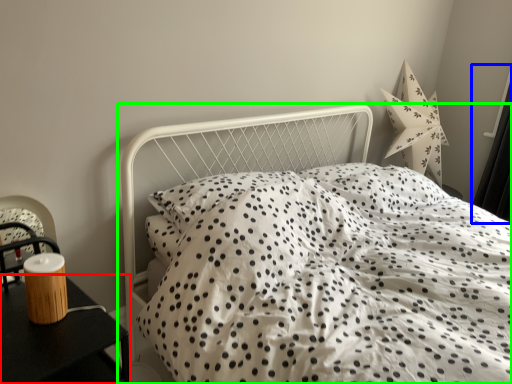
Question: Estimate the real-world distances between objects in this image. Which object is closer to nightstand (highlighted by a red box), curtain (highlighted by a blue box) or bed (highlighted by a green box)?

Choices:
 (A) curtain
 (B) bed

Answer: (B)